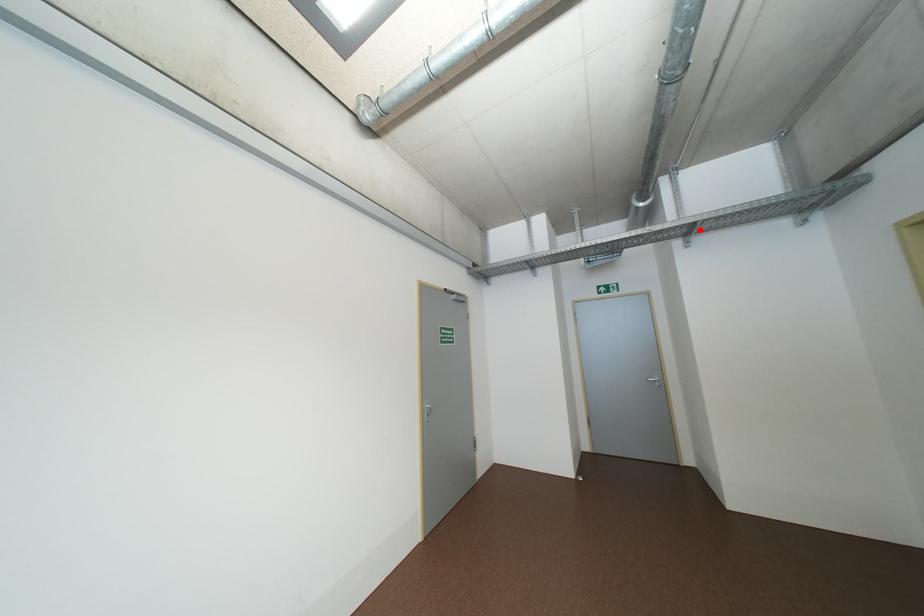
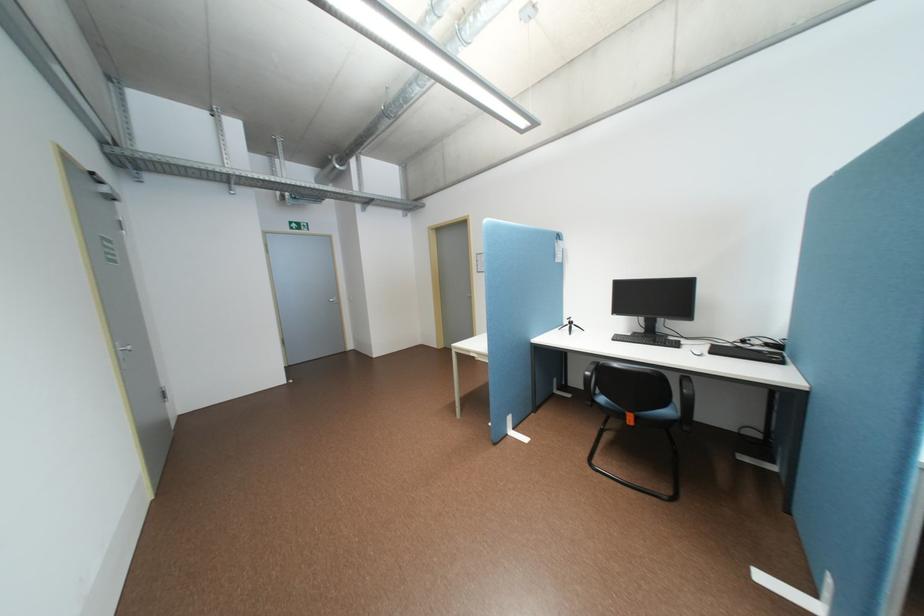
Locate, in the second image, the point that corresponds to the highlighted location in the first image.

(379, 201)